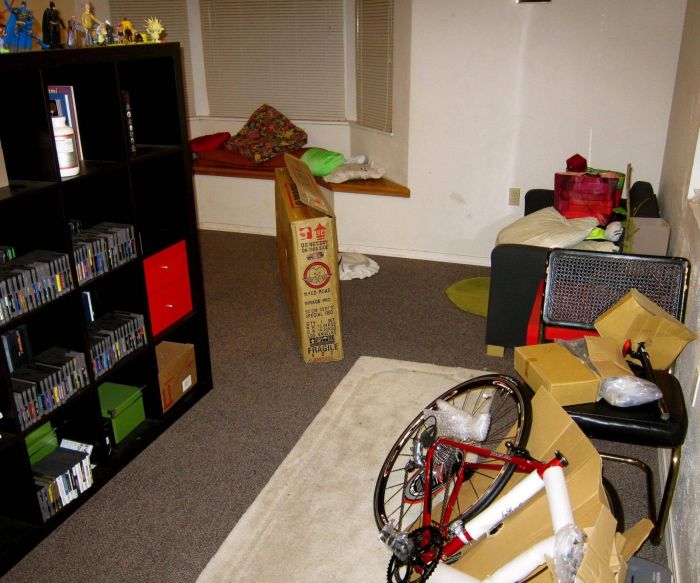
Locate an element on the screen. Image resolution: width=700 pixels, height=583 pixels. cushions is located at coordinates (203, 142), (225, 154), (255, 145), (315, 160), (350, 171), (539, 224).